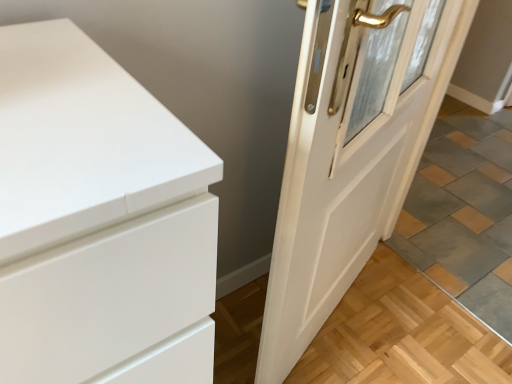
This screenshot has height=384, width=512. Describe the element at coordinates (349, 159) in the screenshot. I see `white glossy door at center` at that location.

The image size is (512, 384). I want to click on white glossy door at center, so click(349, 159).

Measure the distance between white glossy door at center and camera.

white glossy door at center is 21.93 inches from camera.

The width and height of the screenshot is (512, 384). Find the location of `white glossy door at center`. white glossy door at center is located at coordinates (349, 159).